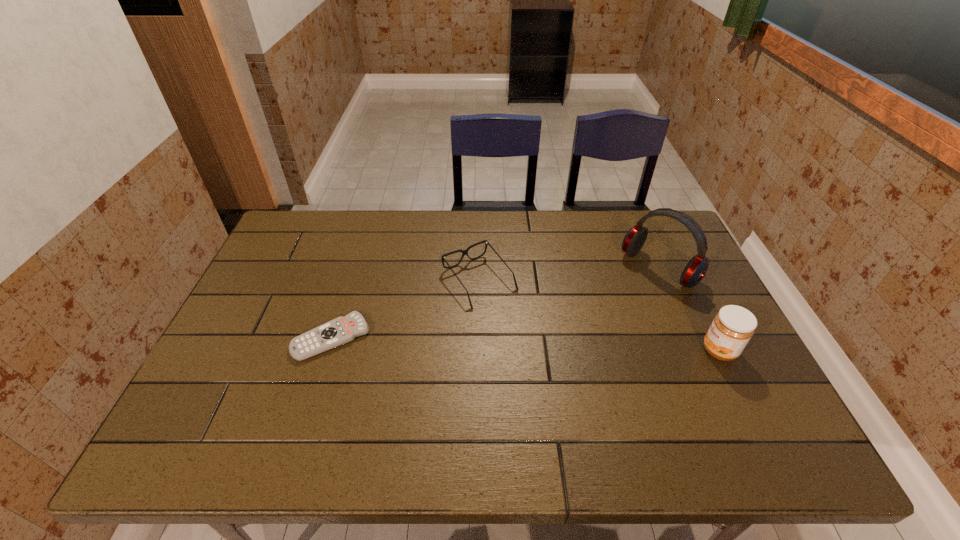
Where is `free space located with the lenses facing outward on the third tallest object`? The width and height of the screenshot is (960, 540). free space located with the lenses facing outward on the third tallest object is located at coordinates (511, 320).

This screenshot has height=540, width=960. In order to click on free space located 0.220m with the lenses facing outward on the third tallest object in this screenshot , I will do (x=545, y=362).

Identify the location of vacant space located with the lenses facing outward on the third tallest object. click(572, 396).

You are a GUI agent. You are given a task and a screenshot of the screen. Output one action in this format:
    pyautogui.click(x=<x>, y=<y>)
    Task: Click on the vacant space positioned 0.400m on the ear cups of the earphone
    Image resolution: width=960 pixels, height=540 pixels.
    Given the screenshot: What is the action you would take?
    pyautogui.click(x=551, y=363)

In order to click on free region located on the ear cups of the earphone in this screenshot , I will do `click(607, 314)`.

In order to click on vacant space located on the ear cups of the earphone in this screenshot , I will do click(x=564, y=352).

The image size is (960, 540). Identify the location of object that is at the far edge. (696, 269).

The image size is (960, 540). I want to click on jam positioned at the right edge, so point(732,328).

Locate an element on the screen. The height and width of the screenshot is (540, 960). earphone present at the right edge is located at coordinates (696, 269).

Locate an element on the screen. This screenshot has height=540, width=960. object present at the far right corner is located at coordinates [696, 269].